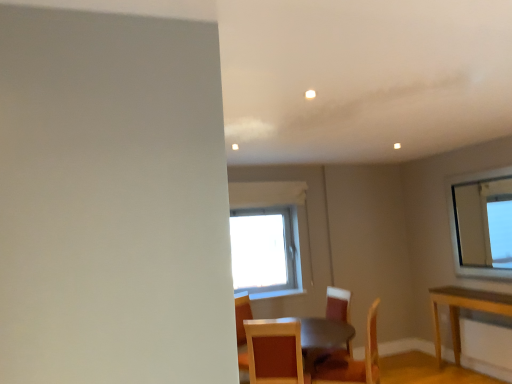
Question: Does wooden textured chair at lower center, which is counted as the first chair, starting from the front, appear on the left side of wooden chair at center, marked as the 2th chair in a front-to-back arrangement?

Choices:
 (A) no
 (B) yes

Answer: (B)

Question: Can you confirm if wooden textured chair at lower center, which is counted as the first chair, starting from the front, is bigger than wooden chair at center, marked as the 2th chair in a front-to-back arrangement?

Choices:
 (A) no
 (B) yes

Answer: (A)

Question: Is wooden textured chair at lower center, arranged as the third chair when viewed from the back, in contact with wooden chair at center, marked as the 2th chair in a front-to-back arrangement?

Choices:
 (A) yes
 (B) no

Answer: (B)

Question: From a real-world perspective, is wooden textured chair at lower center, arranged as the third chair when viewed from the back, physically above wooden chair at center, marked as the 2th chair in a front-to-back arrangement?

Choices:
 (A) no
 (B) yes

Answer: (B)

Question: Can wooden chair at center, which is counted as the 2th chair, starting from the back, be found inside wooden textured chair at lower center, arranged as the third chair when viewed from the back?

Choices:
 (A) yes
 (B) no

Answer: (B)

Question: Can you confirm if wooden textured chair at lower center, which is counted as the first chair, starting from the front, is wider than wooden chair at center, which is counted as the 2th chair, starting from the back?

Choices:
 (A) no
 (B) yes

Answer: (B)

Question: Is wooden textured chair at lower center, arranged as the third chair when viewed from the back, bigger than wooden chair at center, positioned as the 1th chair in back-to-front order?

Choices:
 (A) yes
 (B) no

Answer: (B)

Question: From a real-world perspective, does wooden textured chair at lower center, arranged as the third chair when viewed from the back, stand above wooden chair at center, which appears as the 3th chair when viewed from the front?

Choices:
 (A) no
 (B) yes

Answer: (B)

Question: Does wooden textured chair at lower center, arranged as the third chair when viewed from the back, have a lesser width compared to wooden chair at center, which appears as the 3th chair when viewed from the front?

Choices:
 (A) no
 (B) yes

Answer: (A)

Question: Would you say wooden textured chair at lower center, which is counted as the first chair, starting from the front, contains wooden chair at center, which appears as the 3th chair when viewed from the front?

Choices:
 (A) no
 (B) yes

Answer: (A)

Question: From the image's perspective, is wooden textured chair at lower center, which is counted as the first chair, starting from the front, over wooden chair at center, which appears as the 3th chair when viewed from the front?

Choices:
 (A) no
 (B) yes

Answer: (B)

Question: Does wooden textured chair at lower center, which is counted as the first chair, starting from the front, have a greater width compared to wooden chair at center, which appears as the 3th chair when viewed from the front?

Choices:
 (A) no
 (B) yes

Answer: (B)

Question: Can you confirm if wooden chair at center, which appears as the 3th chair when viewed from the front, is thinner than wooden chair at center, which is counted as the 2th chair, starting from the back?

Choices:
 (A) no
 (B) yes

Answer: (B)